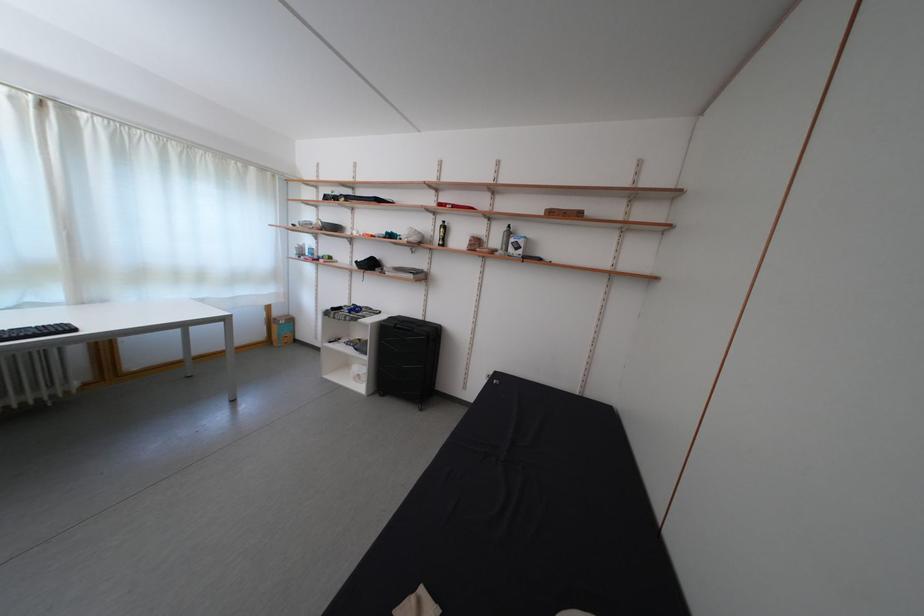
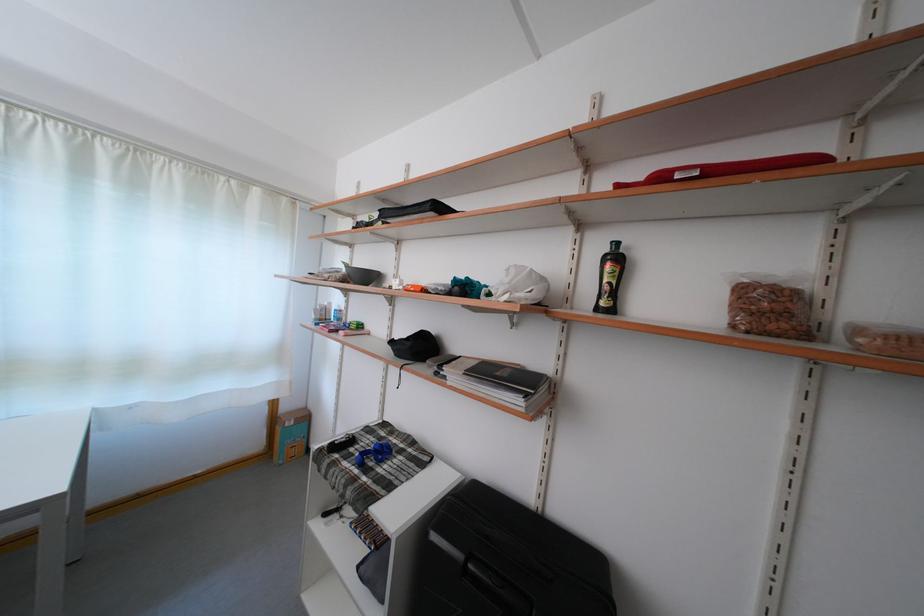
Where in the second image is the point corresponding to pixel 325 328 from the first image?

(344, 436)